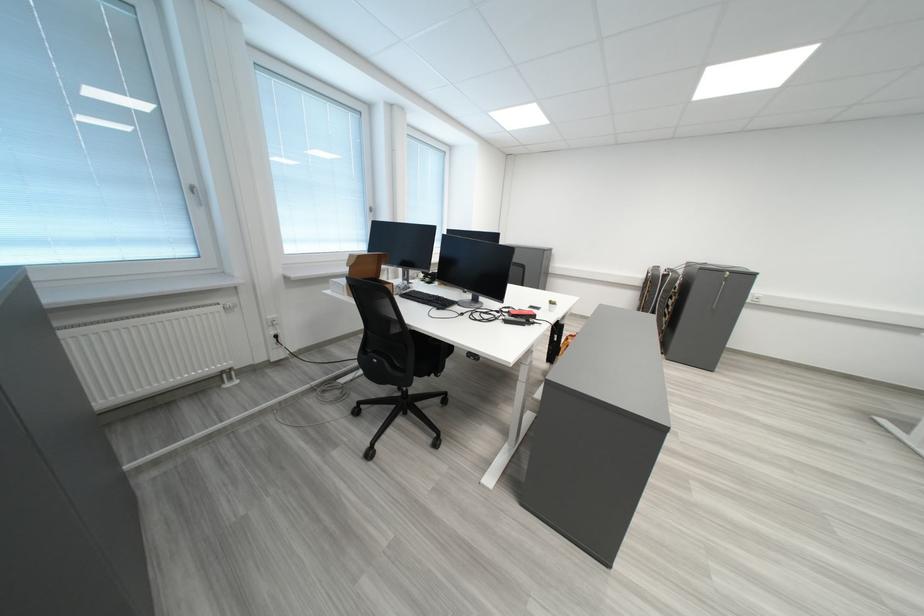
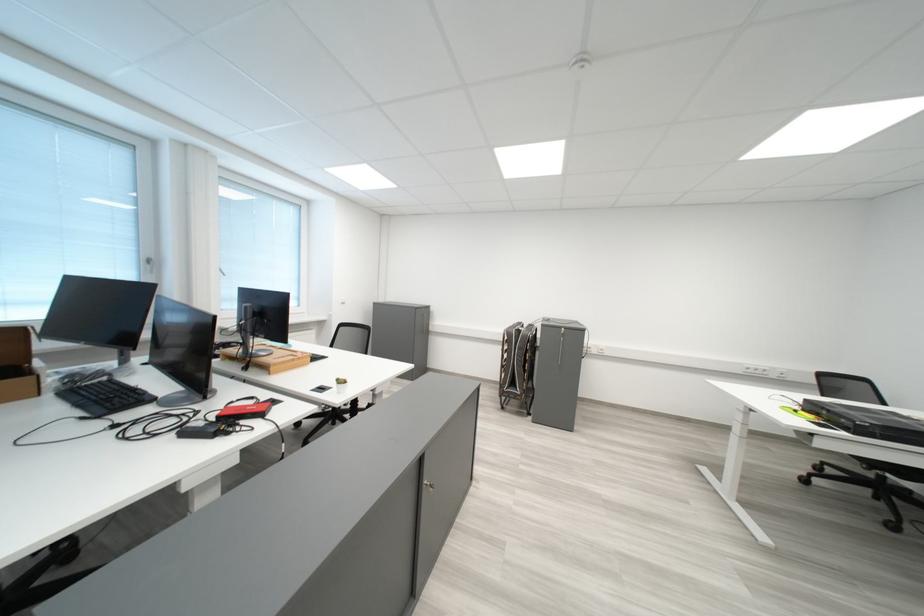
Where in the second image is the point corresponding to the point at 557,306 from the first image?

(345, 386)